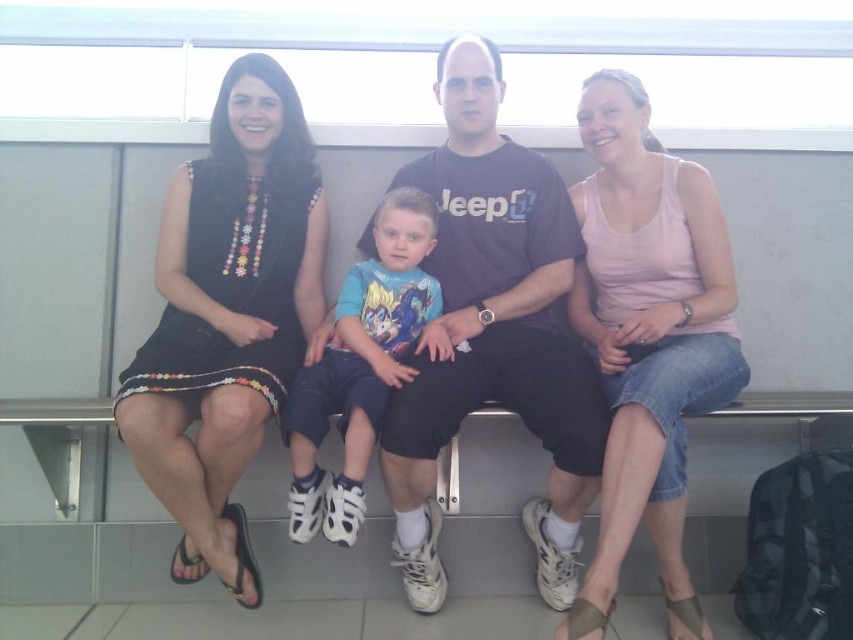
The young boy is wearing a pink cotton tank top at center and a blue cotton shirt at center. Which piece of clothing is visible on top?

The pink cotton tank top at center is located above the blue cotton shirt at center, so the pink cotton tank top at center is visible on top.

You are a photographer standing in front of the bench. You want to take a photo of the matte black dress at left and the blue cotton shirt at center so that both are fully visible in the frame. Given their height difference, which clothing item should you adjust your camera angle to focus on to ensure both are in focus?

The matte black dress at left is taller than the blue cotton shirt at center. To ensure both are in focus, you should adjust your camera angle to focus on the matte black dress at left since it is taller and requires the camera to capture a wider vertical space.